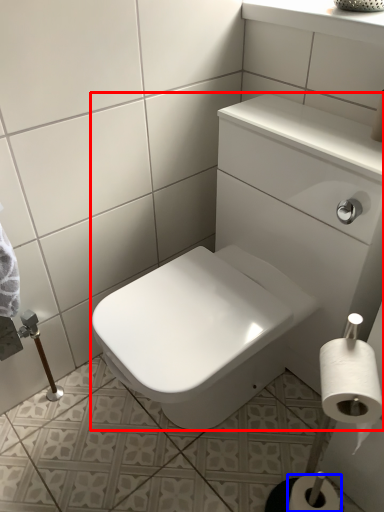
Question: Among these objects, which one is farthest to the camera, sink (highlighted by a red box) or toilet paper (highlighted by a blue box)?

Choices:
 (A) sink
 (B) toilet paper

Answer: (B)